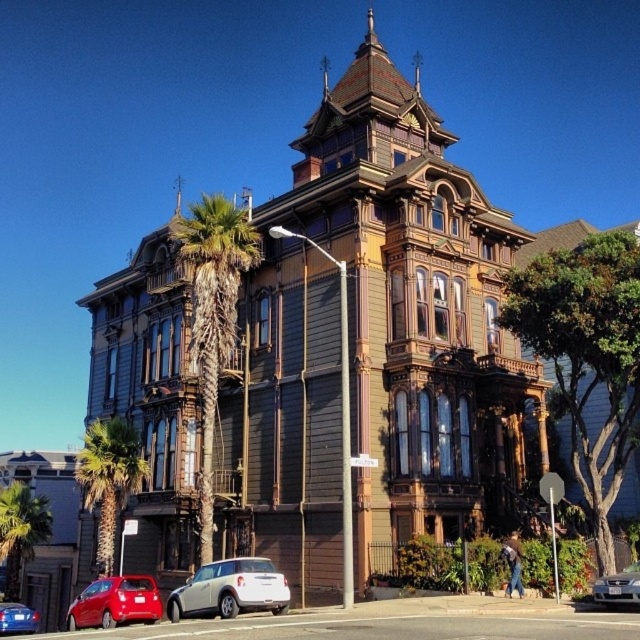
You are a delivery driver arriving at the Victorian house and need to park your vehicle. You see a white matte car at lower center and a metallic blue sedan at lower left. Which parking spot is closer to the streetlight in front of the house?

The metallic blue sedan at lower left is closer to the streetlight in front of the house because the white matte car at lower center is positioned to its right, meaning the metallic blue sedan is nearer to the front of the scene where the streetlight is located.

You are a delivery driver approaching the house and need to park your vehicle. You see the white matte car at lower center and the metallic blue sedan at lower left. Which car is blocking the driveway, making it harder to park?

The white matte car at lower center is blocking the driveway because it is in front of the metallic blue sedan at lower left, which means it is closer to the entrance and obstructing the path.

You are standing at the point marked as point (104, 433) in the image, which is 57.66 meters away from you. You want to take a photo of the grand Victorian house with the ornate wooden balconies and the central tower. Is the house visible in your current position?

The point marked as point (104, 433) is 57.66 meters away from you. Since the house is part of the scene described in the image, it should be visible from that position as long as there are no obstructions. However, the exact visibility might depend on factors like the camera lens and angle, but based on the provided information, the house is within the scene and should be visible.